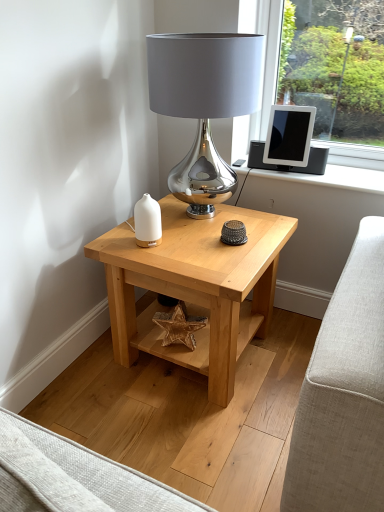
Question: Choose the correct answer: Is satin silver lamp at center inside white matte vase at center or outside it?

Choices:
 (A) inside
 (B) outside

Answer: (B)

Question: Looking at their shapes, would you say satin silver lamp at center is wider or thinner than white matte vase at center?

Choices:
 (A) thin
 (B) wide

Answer: (B)

Question: Estimate the real-world distances between objects in this image. Which object is closer to the satin silver lamp at center?

Choices:
 (A) light wood table at center
 (B) white matte vase at center
 (C) matte black tablet at upper right

Answer: (B)

Question: Which object is positioned farthest from the matte black tablet at upper right?

Choices:
 (A) white matte vase at center
 (B) light wood table at center
 (C) satin silver lamp at center

Answer: (A)